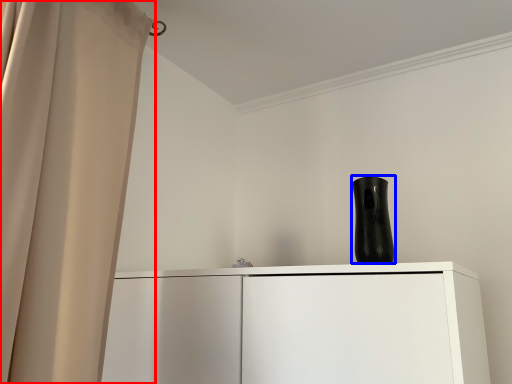
Question: Which object is closer to the camera taking this photo, curtain (highlighted by a red box) or vase (highlighted by a blue box)?

Choices:
 (A) curtain
 (B) vase

Answer: (A)